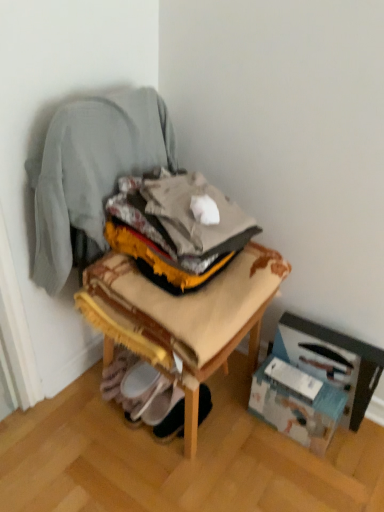
Where is `free spot in front of teal cardboard box at lower right, positioned as the 1th cardboard box in left-to-right order`? free spot in front of teal cardboard box at lower right, positioned as the 1th cardboard box in left-to-right order is located at coordinates (300, 471).